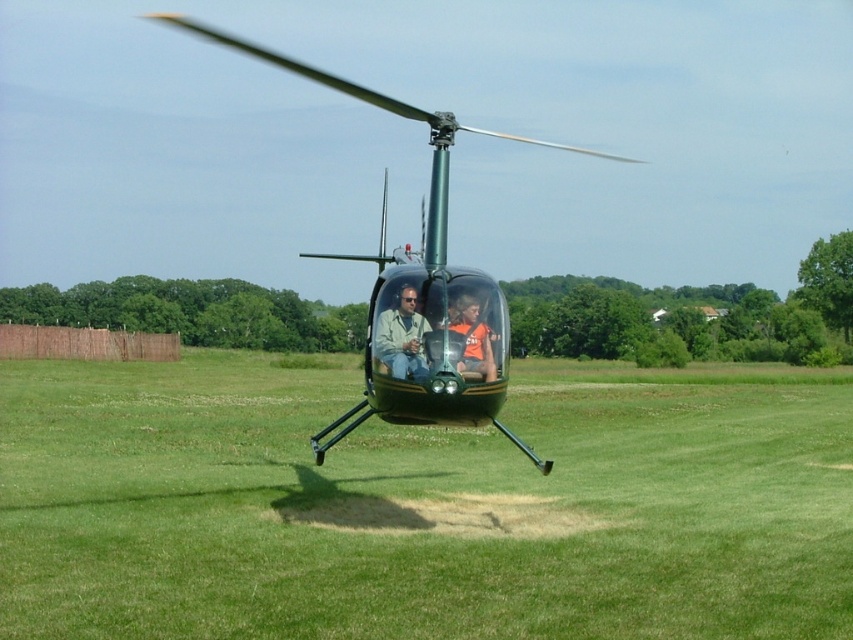
Looking at this image, you are a pilot observing the matte green helicopter at center and the orange jersey at center from above. Which object is positioned to the east?

The matte green helicopter at center is to the left of orange jersey at center. Since left is typically north in aviation, the matte green helicopter at center is positioned to the east.